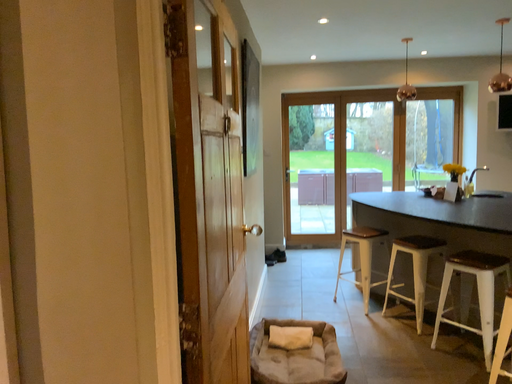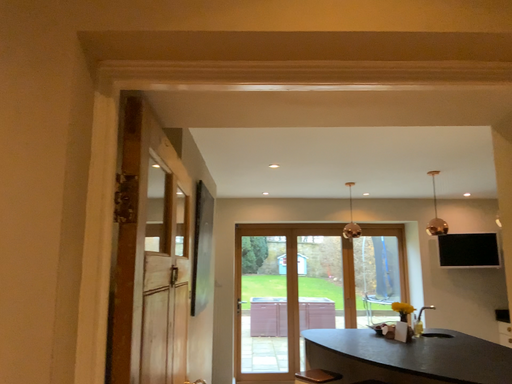
Question: Which way did the camera rotate in the video?

Choices:
 (A) rotated right
 (B) rotated left

Answer: (A)